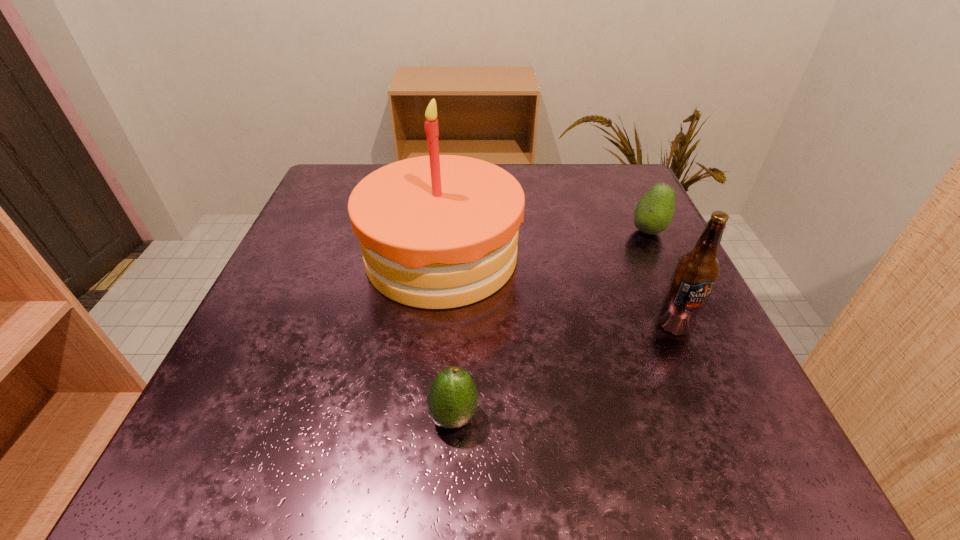
Image resolution: width=960 pixels, height=540 pixels. In order to click on birthday cake in this screenshot , I will do `click(441, 231)`.

The height and width of the screenshot is (540, 960). In order to click on the second tallest object in this screenshot , I will do `click(696, 273)`.

At what (x,y) coordinates should I click in order to perform the action: click on the right avocado. Please return your answer as a coordinate pair (x, y). Image resolution: width=960 pixels, height=540 pixels. Looking at the image, I should click on (654, 212).

Image resolution: width=960 pixels, height=540 pixels. Identify the location of the nearest object. [452, 397].

Find the location of a particular element. Image resolution: width=960 pixels, height=540 pixels. the left avocado is located at coordinates (452, 397).

You are a GUI agent. You are given a task and a screenshot of the screen. Output one action in this format:
    pyautogui.click(x=<x>, y=<y>)
    Task: Click on the vacant space located 0.070m on the front of the birthday cake
    
    Given the screenshot: What is the action you would take?
    pyautogui.click(x=432, y=347)

Image resolution: width=960 pixels, height=540 pixels. Find the location of `vacant region located on the label of the second tallest object`. vacant region located on the label of the second tallest object is located at coordinates (738, 470).

Identify the location of free point located on the front of the farther avocado. (664, 265).

Locate an element on the screen. Image resolution: width=960 pixels, height=540 pixels. free location located on the right of the shorter avocado is located at coordinates (560, 416).

Identify the location of object that is at the far edge. This screenshot has width=960, height=540. (441, 231).